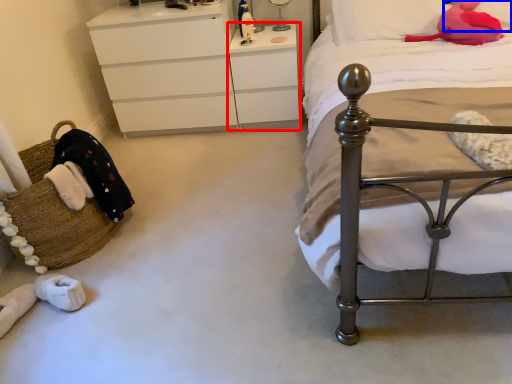
Question: Which object is further to the camera taking this photo, changing table (highlighted by a red box) or pillow (highlighted by a blue box)?

Choices:
 (A) changing table
 (B) pillow

Answer: (A)